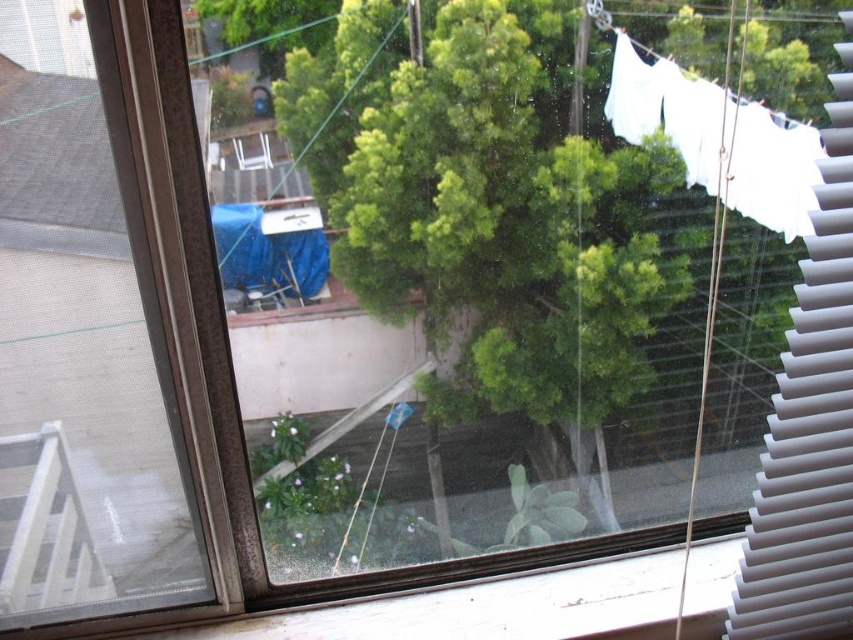
Question: Is the position of white plastic blinds at right more distant than that of white fabric clothesline at upper right?

Choices:
 (A) no
 (B) yes

Answer: (A)

Question: Among these objects, which one is farthest from the camera?

Choices:
 (A) white plastic blinds at right
 (B) white fabric clothesline at upper right

Answer: (B)

Question: Is white plastic blinds at right bigger than white fabric clothesline at upper right?

Choices:
 (A) yes
 (B) no

Answer: (A)

Question: Which object is farther from the camera taking this photo?

Choices:
 (A) white plastic blinds at right
 (B) white fabric clothesline at upper right

Answer: (B)

Question: Does white plastic blinds at right have a larger size compared to white fabric clothesline at upper right?

Choices:
 (A) no
 (B) yes

Answer: (B)

Question: Which object is closer to the camera taking this photo?

Choices:
 (A) white fabric clothesline at upper right
 (B) white plastic blinds at right

Answer: (B)